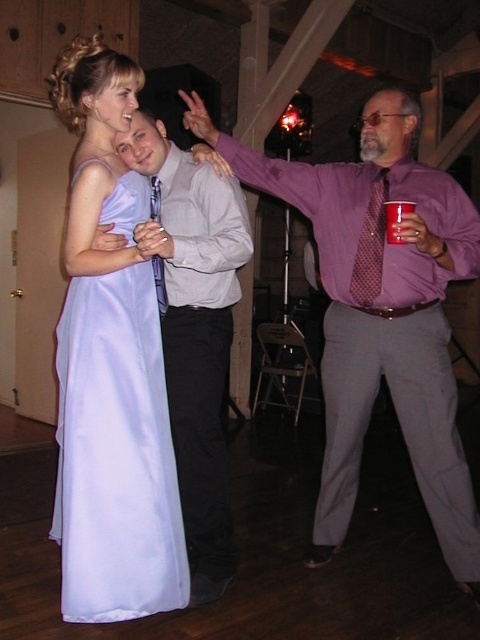
Who is higher up, polka dot silk tie at right or white paper cup at center?

white paper cup at center is above.

Does point (370, 230) come behind point (385, 202)?

Yes, it is.

Where is `polka dot silk tie at right`? The width and height of the screenshot is (480, 640). polka dot silk tie at right is located at coordinates (371, 244).

What do you see at coordinates (116, 452) in the screenshot? Image resolution: width=480 pixels, height=640 pixels. I see `satin white dress at left` at bounding box center [116, 452].

Is satin white dress at left positioned at the back of polka dot silk tie at right?

No, satin white dress at left is closer to the viewer.

The height and width of the screenshot is (640, 480). Describe the element at coordinates (116, 452) in the screenshot. I see `satin white dress at left` at that location.

What are the coordinates of `satin white dress at left` in the screenshot? It's located at (116, 452).

Can you confirm if matte gray shirt at center is positioned to the left of polka dot silk tie at right?

Yes, matte gray shirt at center is to the left of polka dot silk tie at right.

From the picture: Does matte gray shirt at center appear on the right side of polka dot silk tie at right?

No, matte gray shirt at center is not to the right of polka dot silk tie at right.

Who is more distant from viewer, (x=207, y=497) or (x=381, y=268)?

Positioned behind is point (x=381, y=268).

Locate an element on the screen. The width and height of the screenshot is (480, 640). matte gray shirt at center is located at coordinates (194, 332).